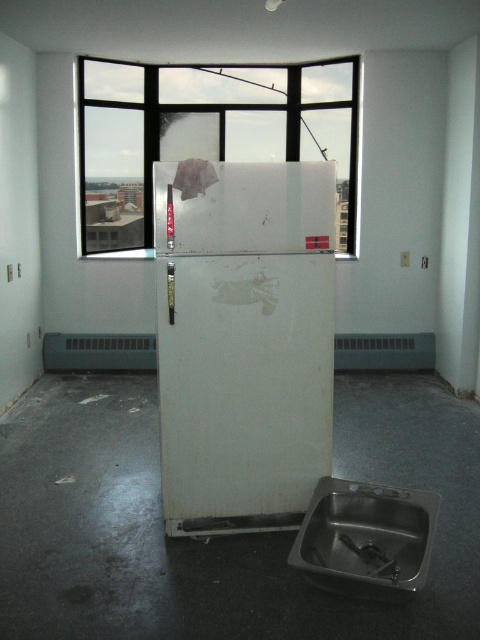
Which is more to the left, white matte refrigerator at center or stainless steel sink at lower right?

white matte refrigerator at center is more to the left.

How distant is white matte refrigerator at center from stainless steel sink at lower right?

white matte refrigerator at center is 21.63 inches away from stainless steel sink at lower right.

Who is more forward, (275, 237) or (324, 566)?

Point (324, 566) is more forward.

At what (x,y) coordinates should I click in order to perform the action: click on white matte refrigerator at center. Please return your answer as a coordinate pair (x, y). The width and height of the screenshot is (480, 640). Looking at the image, I should click on (242, 340).

Does transparent glass window at center have a greater height compared to satin nickel faucet at lower right?

Correct, transparent glass window at center is much taller as satin nickel faucet at lower right.

Between transparent glass window at center and satin nickel faucet at lower right, which one is positioned lower?

Positioned lower is satin nickel faucet at lower right.

Who is more forward, (139, 122) or (347, 538)?

Point (347, 538) is in front.

Where is `transparent glass window at center`? The height and width of the screenshot is (640, 480). transparent glass window at center is located at coordinates (206, 132).

Who is more distant from viewer, (408, 540) or (359, 552)?

The point (408, 540) is more distant.

Who is positioned more to the left, stainless steel sink at lower right or satin nickel faucet at lower right?

stainless steel sink at lower right is more to the left.

Who is more distant from viewer, (288, 557) or (344, 532)?

The point (344, 532) is behind.

Locate an element on the screen. Image resolution: width=480 pixels, height=640 pixels. stainless steel sink at lower right is located at coordinates (365, 538).